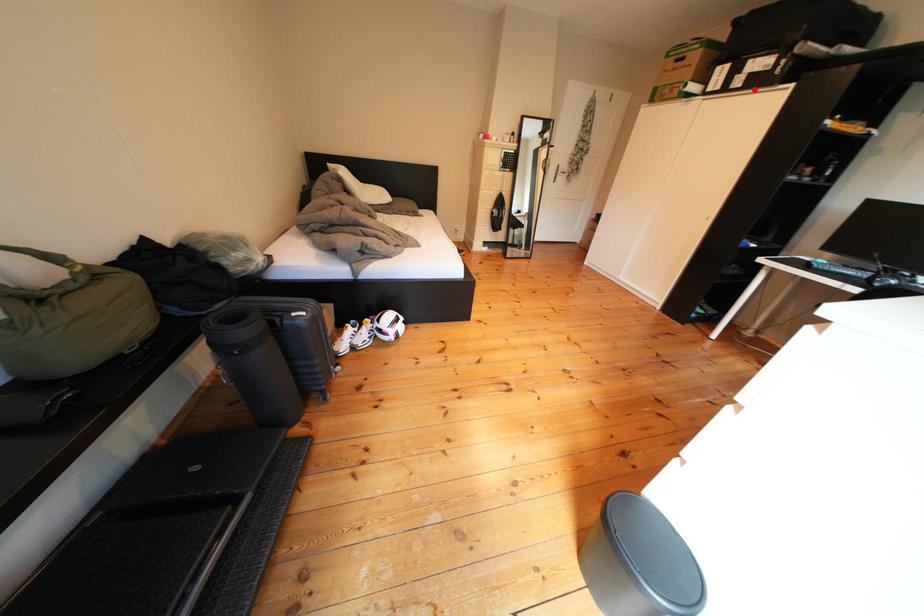
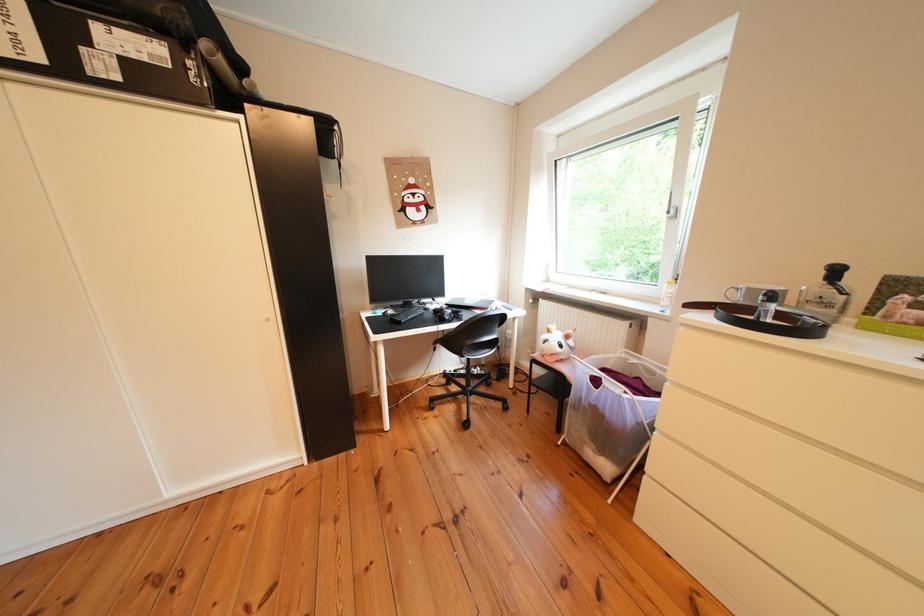
Find the pixel in the second image that matches the highlighted location in the first image.

(131, 83)